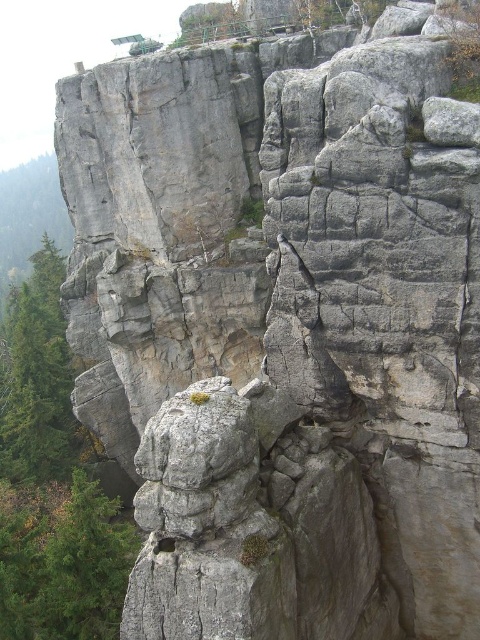
Is green rough tree at lower left to the left of green rough tree at left from the viewer's perspective?

Incorrect, green rough tree at lower left is not on the left side of green rough tree at left.

Which is behind, point (50, 634) or point (44, 317)?

The point (44, 317) is behind.

Locate an element on the screen. The height and width of the screenshot is (640, 480). green rough tree at lower left is located at coordinates (62, 563).